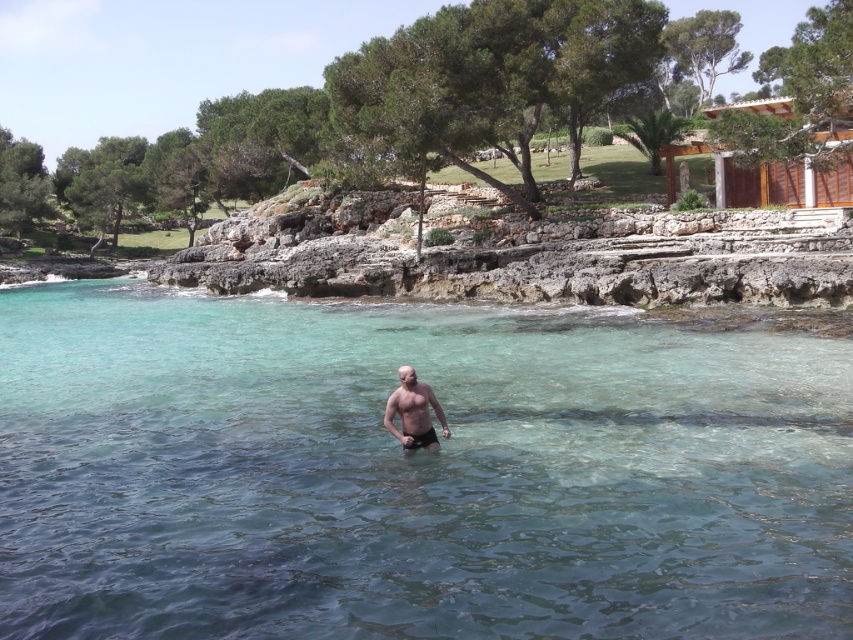
You are a photographer planning to capture the scene of the clear water at center and the smooth skin man at center. Considering their sizes, which object should you focus on first to ensure both are in frame without moving the camera?

The clear water at center has a larger size compared to the smooth skin man at center, so you should focus on the clear water at center first to ensure both fit in the frame.

Consider the image. You are standing on the rocky shoreline and want to reach the wooden structure in the background. There is a point marked at coordinates (413, 472) which indicates clear water at center. Based on the scene description, is this point the best path to take to reach the wooden structure?

The point at (413, 472) marks clear water at center. Since the wooden structure is located on the grassy area behind the trees, the best path would likely be on land, avoiding the water. Therefore, this point in the water is not the best path to reach the wooden structure.